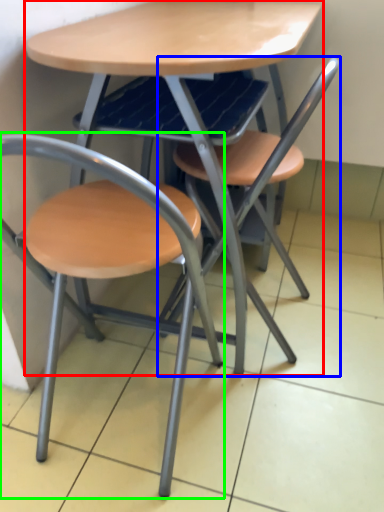
Question: Estimate the real-world distances between objects in this image. Which object is closer to table (highlighted by a red box), chair (highlighted by a blue box) or chair (highlighted by a green box)?

Choices:
 (A) chair
 (B) chair

Answer: (A)